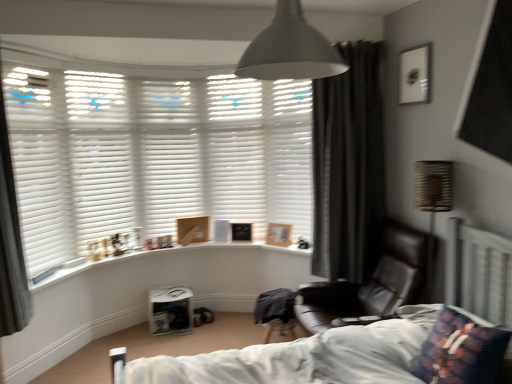
Question: Is dark floral fabric pillow at lower right not within matte black picture frame at upper right, arranged as the 1th picture frame when viewed from the top?

Choices:
 (A) no
 (B) yes

Answer: (B)

Question: Can you confirm if dark floral fabric pillow at lower right is smaller than matte black picture frame at upper right, acting as the 4th picture frame starting from the left?

Choices:
 (A) no
 (B) yes

Answer: (A)

Question: From a real-world perspective, is dark floral fabric pillow at lower right positioned over matte black picture frame at upper right, acting as the 4th picture frame starting from the left, based on gravity?

Choices:
 (A) no
 (B) yes

Answer: (A)

Question: Is dark floral fabric pillow at lower right facing away from matte black picture frame at upper right, which is the 1th picture frame in right-to-left order?

Choices:
 (A) yes
 (B) no

Answer: (B)

Question: From a real-world perspective, does dark floral fabric pillow at lower right sit lower than matte black picture frame at upper right, which appears as the fourth picture frame when viewed from the back?

Choices:
 (A) yes
 (B) no

Answer: (A)

Question: Is dark floral fabric pillow at lower right surrounding matte black picture frame at upper right, which is the 1th picture frame in right-to-left order?

Choices:
 (A) yes
 (B) no

Answer: (B)

Question: From a real-world perspective, is white matte blinds at left, placed as the fifth shutter when sorted from right to left, on top of white matte shutter at upper center, which appears as the 2th shutter when viewed from the right?

Choices:
 (A) no
 (B) yes

Answer: (A)

Question: Are white matte blinds at left, the 1th shutter viewed from the left, and white matte shutter at upper center, marked as the 4th shutter in a left-to-right arrangement, located far from each other?

Choices:
 (A) yes
 (B) no

Answer: (A)

Question: Can you confirm if white matte blinds at left, the 1th shutter viewed from the left, is positioned to the left of white matte shutter at upper center, marked as the 4th shutter in a left-to-right arrangement?

Choices:
 (A) no
 (B) yes

Answer: (B)

Question: Is white matte blinds at left, placed as the fifth shutter when sorted from right to left, thinner than white matte shutter at upper center, which appears as the 2th shutter when viewed from the right?

Choices:
 (A) yes
 (B) no

Answer: (B)

Question: Does white matte blinds at left, the 1th shutter viewed from the left, come in front of white matte shutter at upper center, marked as the 4th shutter in a left-to-right arrangement?

Choices:
 (A) yes
 (B) no

Answer: (A)

Question: Would you say white matte shutter at upper center, marked as the 4th shutter in a left-to-right arrangement, is part of white matte blinds at left, the 1th shutter viewed from the left,'s contents?

Choices:
 (A) yes
 (B) no

Answer: (B)

Question: Considering the relative sizes of matte black picture frame at upper right, which is the 1th picture frame in right-to-left order, and white matte blinds at left, the 1th shutter viewed from the left, in the image provided, is matte black picture frame at upper right, which is the 1th picture frame in right-to-left order, smaller than white matte blinds at left, the 1th shutter viewed from the left,?

Choices:
 (A) no
 (B) yes

Answer: (B)